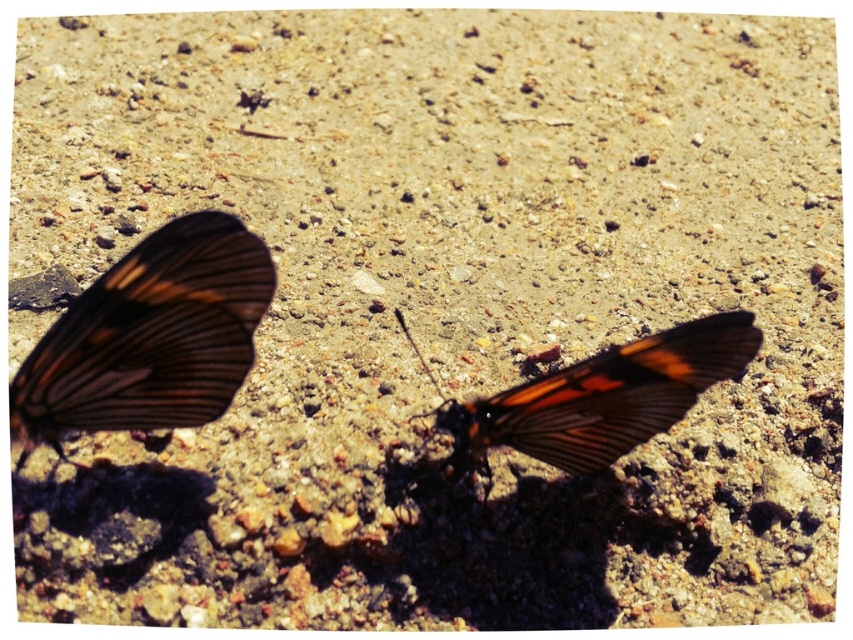
You are observing two points on the ground where butterflies are resting. The points are labeled as point [166,280] and point [556,400]. From your vantage point, which point is nearer to you?

Point [166,280] is closer to the camera than point [556,400], so the point [166,280] is nearer to you.

You are a researcher studying butterfly behavior. You observe the shiny brown butterfly at left in the image. Can you determine its exact coordinates on the ground?

The shiny brown butterfly at left is located at coordinates point (149,337).